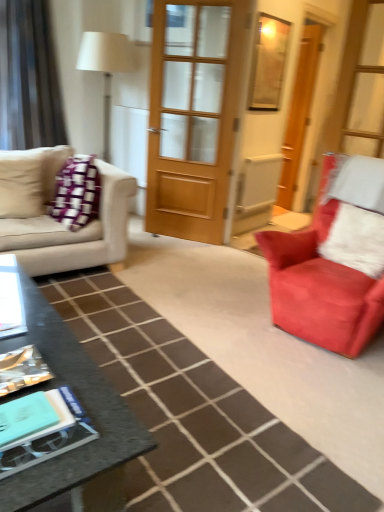
This screenshot has width=384, height=512. What are the coordinates of `vacant space that is in between wooden door at center, the 2th door viewed from the right, and suede red armchair at right` in the screenshot? It's located at (x=217, y=268).